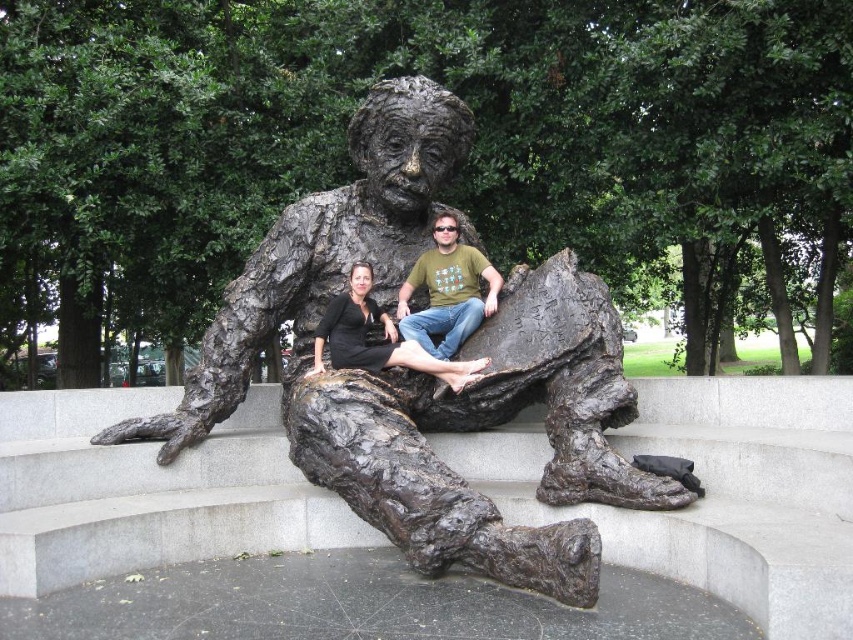
What are the coordinates of the matte bronze statue at center?

The matte bronze statue at center is located at coordinates point (447, 291).

You are standing in front of the bronze Einstein sculpture and notice two points marked on the ground. The first point is labeled as point (x=405, y=129) and the second as point (x=335, y=365). If you want to step closer to the sculpture, which point should you move towards?

You should move towards point (x=405, y=129) because it is closer to you than point (x=335, y=365), which is further away from the camera.